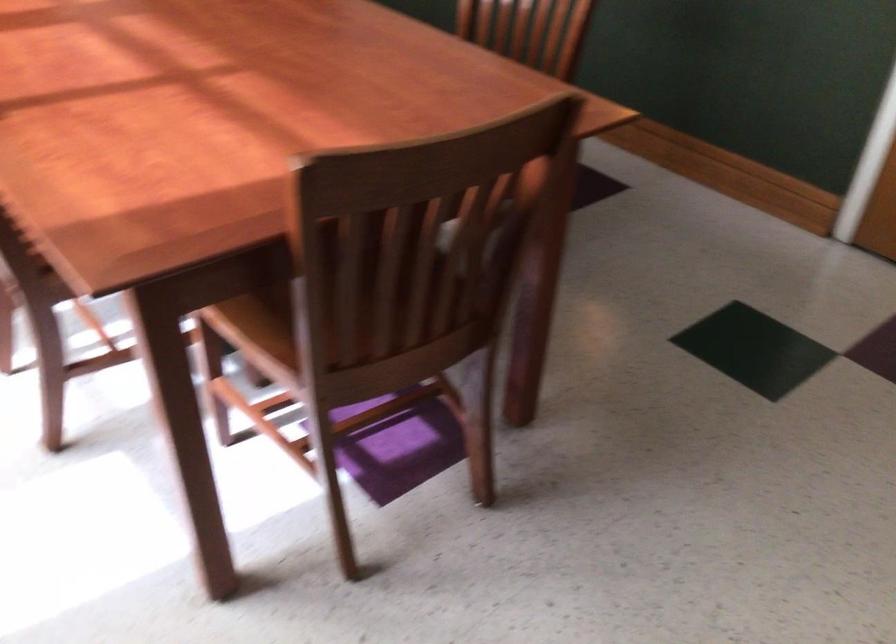
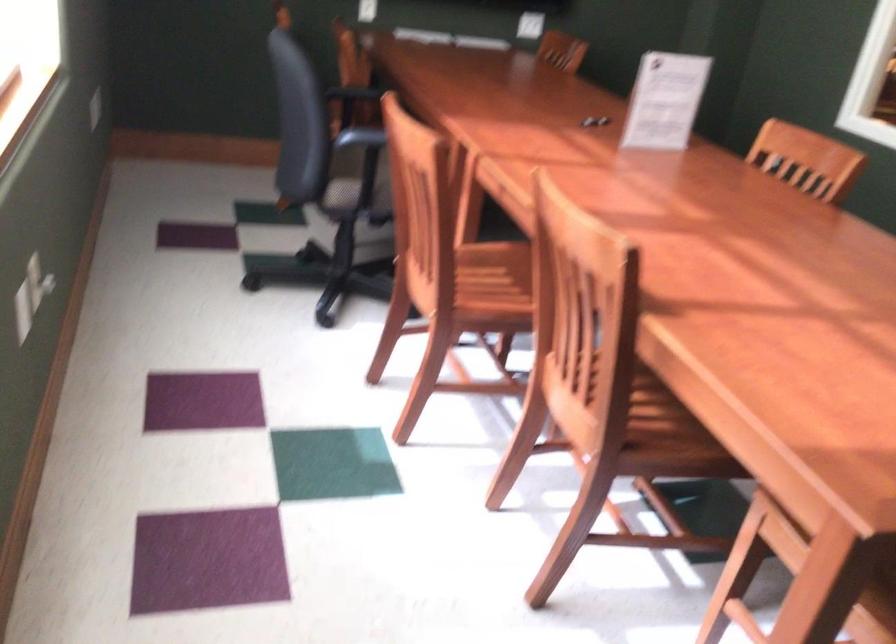
Question: Based on the continuous images, in which direction is the camera rotating? Reply with the corresponding letter.

Choices:
 (A) Left
 (B) Right
 (C) Up
 (D) Down

Answer: (A)